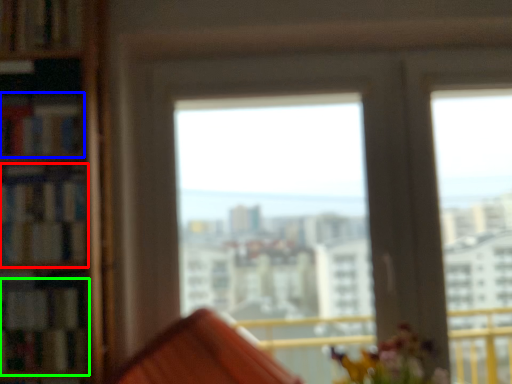
Question: Which is nearer to the book (highlighted by a red box)? book (highlighted by a blue box) or book (highlighted by a green box).

Choices:
 (A) book
 (B) book

Answer: (A)